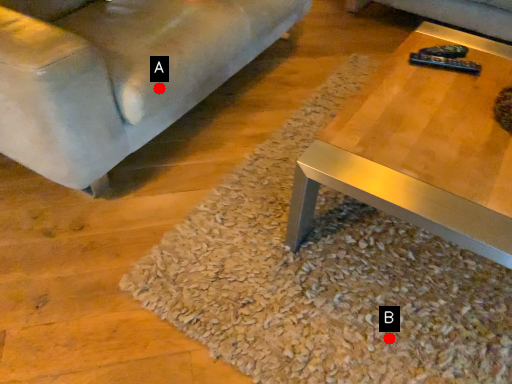
Question: Two points are circled on the image, labeled by A and B beside each circle. Which point is farther to the camera?

Choices:
 (A) A is further
 (B) B is further

Answer: (A)